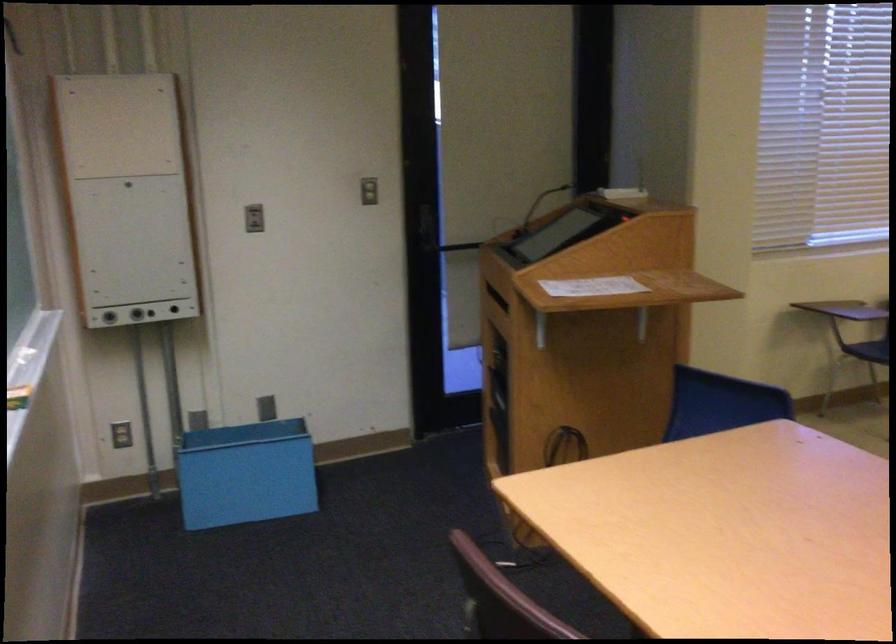
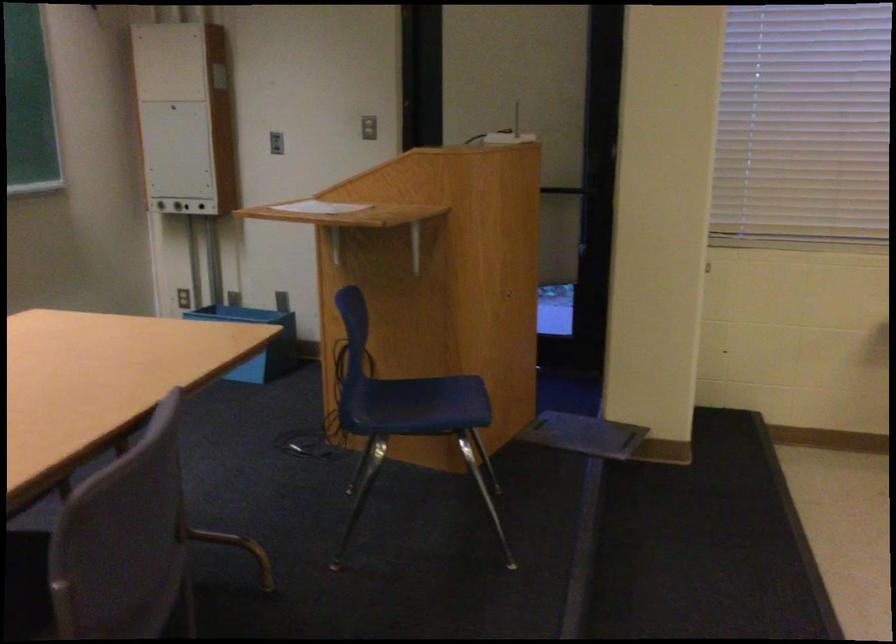
The point at (530, 286) is marked in the first image. Where is the corresponding point in the second image?

(320, 207)